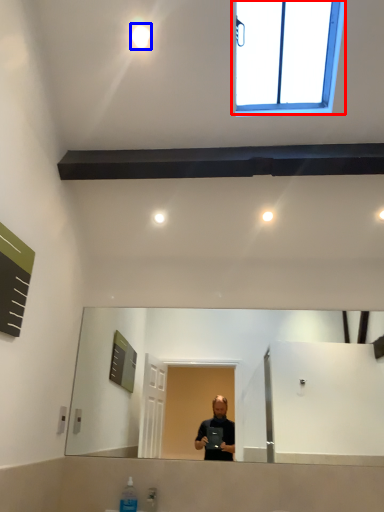
Question: Which object is further to the camera taking this photo, window (highlighted by a red box) or lighting (highlighted by a blue box)?

Choices:
 (A) window
 (B) lighting

Answer: (B)